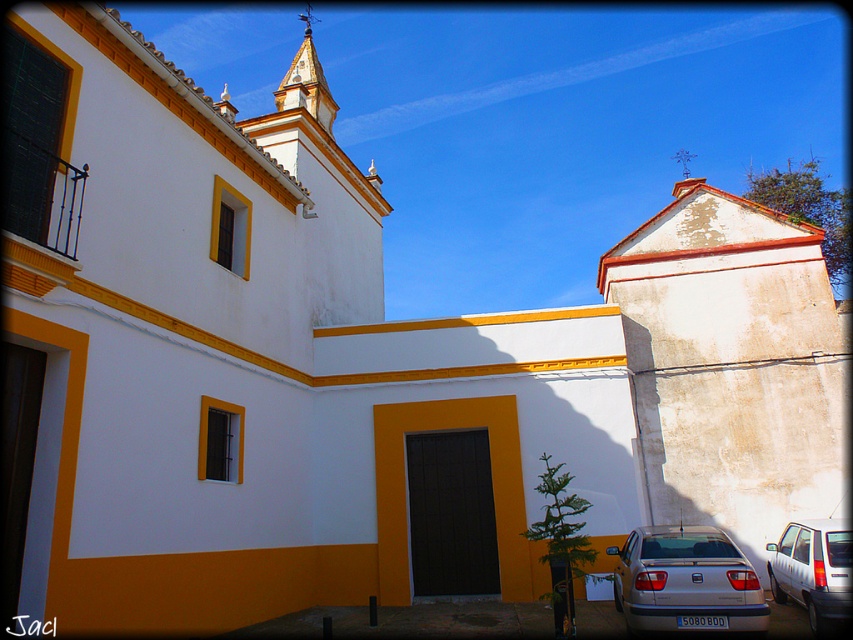
You are standing at the entrance of the building and want to park your car. The parking spot is at point A. Is the silver metallic car at lower right blocking the parking spot?

The silver metallic car at lower right is located at point A, so it is blocking the parking spot.

You are standing in front of the building and notice two points marked on the facade. Which point, point (660, 595) or point (303, 65), is closer to you?

Point (660, 595) is closer to the viewer than point (303, 65).

You are standing at the entrance of the building and want to park your car. There are two cars already parked at the lower right corner. Which car, the silver metallic car at lower right or the white matte car at lower right, is parked closer to the entrance?

The silver metallic car at lower right is closer to the viewer than the white matte car at lower right, so the silver metallic car at lower right is parked closer to the entrance.